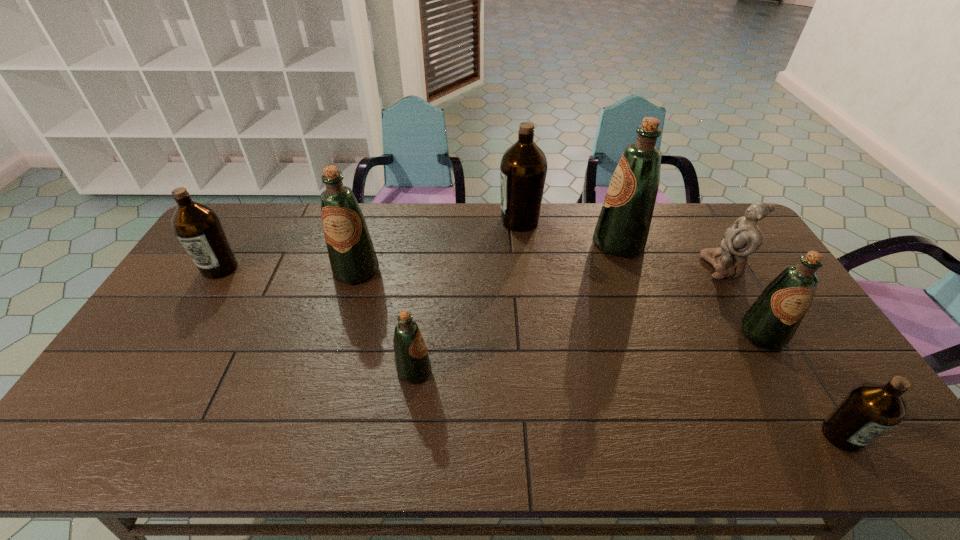
This screenshot has width=960, height=540. I want to click on figurine that is at the right edge, so click(744, 237).

The image size is (960, 540). Identify the location of object situated at the near right corner. (870, 409).

Locate an element on the screen. The height and width of the screenshot is (540, 960). free space at the far edge of the desktop is located at coordinates (370, 213).

The height and width of the screenshot is (540, 960). In the image, there is a desktop. Find the location of `vacant space at the near edge`. vacant space at the near edge is located at coordinates (228, 432).

This screenshot has width=960, height=540. Identify the location of vacant space in between the white figurine and the sixth farthest object. (743, 301).

Find the location of a particular element. The height and width of the screenshot is (540, 960). vacant region between the smallest brown olive oil and the seventh farthest object is located at coordinates (628, 403).

Identify the location of vacant space that is in between the second object from left to right and the tallest olive oil. This screenshot has height=540, width=960. (488, 257).

Identify the location of vacant space in between the tallest object and the second object from left to right. [x=488, y=257].

Image resolution: width=960 pixels, height=540 pixels. I want to click on free space between the leftmost object and the nearest brown olive oil, so click(531, 352).

Locate an element on the screen. This screenshot has width=960, height=540. empty location between the second nearest olive oil and the white figurine is located at coordinates (569, 319).